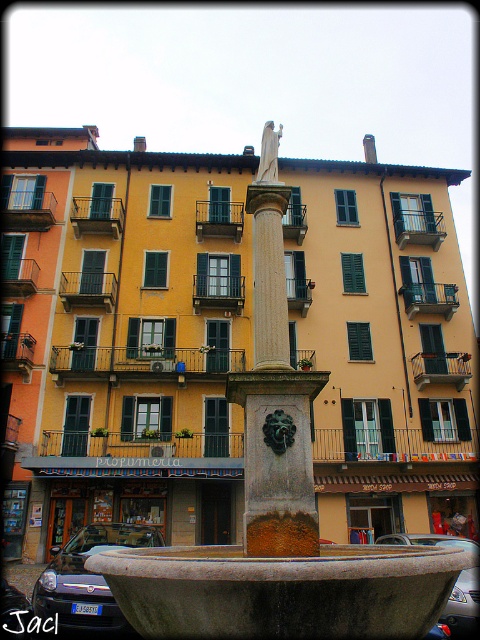
You are a tourist standing in front of the historical fountain and want to take a photo that includes both the statue and the building in the background. You notice two points marked on your map at coordinates point (273, 541) and point (265, 124). Which point should you stand at to ensure the statue is closer to you than the building?

You should stand at point (273, 541) because it is in front of point (265, 124), meaning the statue will be closer to you than the building.

You are an architect evaluating the proportions of the stone fountain at center and the white marble statue at center in the urban scene. Which object is shorter?

The stone fountain at center is shorter than the white marble statue at center.